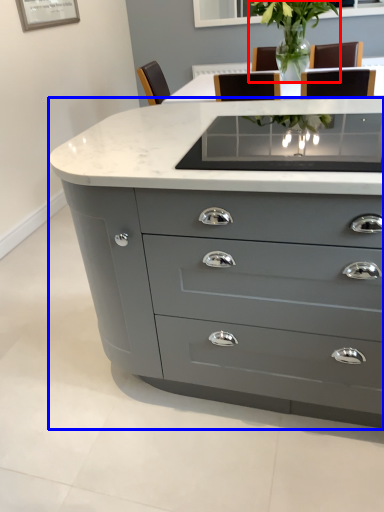
Question: Among these objects, which one is nearest to the camera, plant (highlighted by a red box) or chest of drawers (highlighted by a blue box)?

Choices:
 (A) plant
 (B) chest of drawers

Answer: (B)